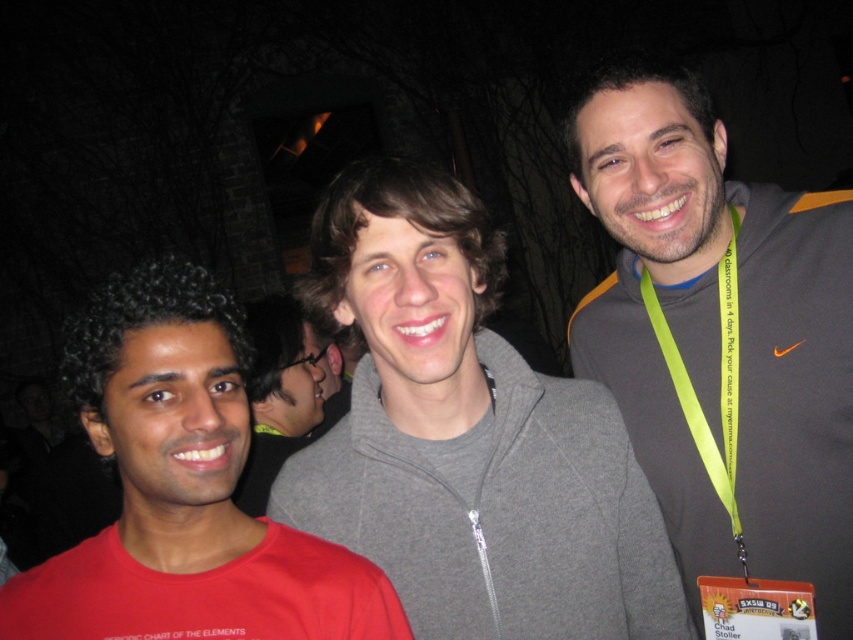
Question: Which is nearer to the gray fleece jacket at center?

Choices:
 (A) gray fleece neck at center
 (B) green fabric lanyard at right
 (C) matte gray hoodie at center
 (D) gray hoodie at center

Answer: (A)

Question: Is gray fleece jacket at center to the right of matte red neck at center from the viewer's perspective?

Choices:
 (A) no
 (B) yes

Answer: (B)

Question: Is gray fleece jacket at center to the right of gray hoodie at center from the viewer's perspective?

Choices:
 (A) no
 (B) yes

Answer: (B)

Question: Based on their relative distances, which object is nearer to the green fabric lanyard at right?

Choices:
 (A) matte gray hoodie at center
 (B) gray hoodie at center

Answer: (A)

Question: Among these points, which one is nearest to the camera?

Choices:
 (A) (225, 308)
 (B) (422, 356)

Answer: (A)

Question: Is matte red neck at center positioned before gray fabric neck at center?

Choices:
 (A) yes
 (B) no

Answer: (A)